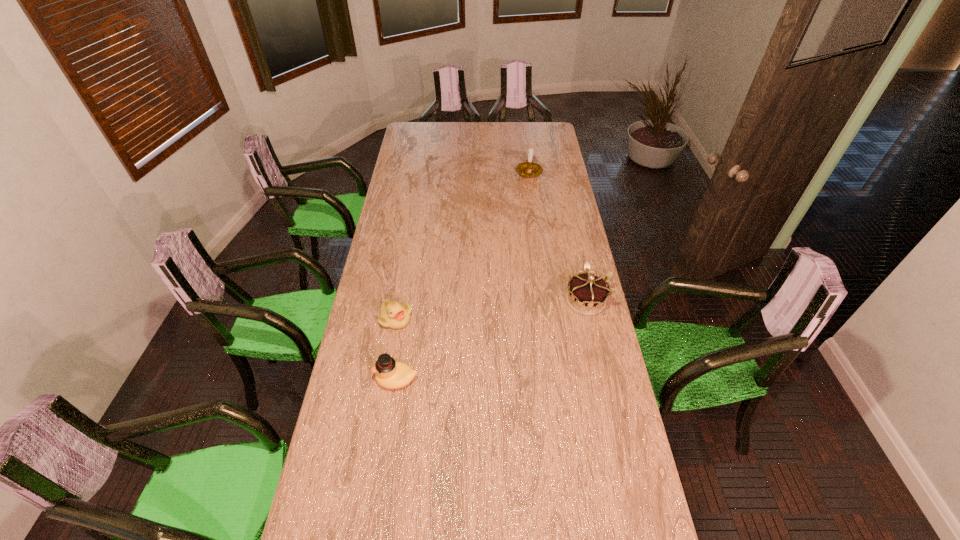
Find the location of a particular element. The image size is (960, 540). free space at the near left corner of the desktop is located at coordinates (367, 487).

Locate an element on the screen. The width and height of the screenshot is (960, 540). free spot between the shortest object and the duck is located at coordinates (396, 349).

At what (x,y) coordinates should I click in order to perform the action: click on free space between the duck and the crown. Please return your answer as a coordinate pair (x, y). The height and width of the screenshot is (540, 960). Looking at the image, I should click on (492, 340).

Image resolution: width=960 pixels, height=540 pixels. What are the coordinates of `free space between the crown and the tallest object` in the screenshot? It's located at (557, 237).

Find the location of a particular element. The image size is (960, 540). free space between the shortest object and the duck is located at coordinates (396, 349).

What are the coordinates of `vacant space that's between the nearest object and the crown` in the screenshot? It's located at (492, 340).

Image resolution: width=960 pixels, height=540 pixels. Identify the location of vacant space that's between the nearest object and the duckling. [x=396, y=349].

Identify the location of free space between the nearest object and the farthest object. (463, 276).

Where is `vacant space that's between the nearest object and the duckling`? vacant space that's between the nearest object and the duckling is located at coordinates (396, 349).

What are the coordinates of `vacant space that's between the farthest object and the shortest object` in the screenshot? It's located at (463, 246).